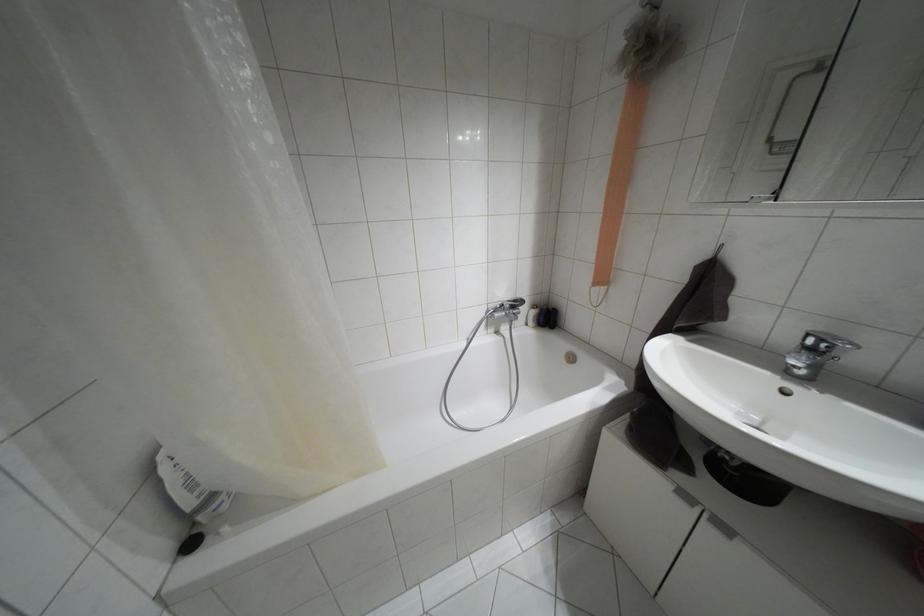
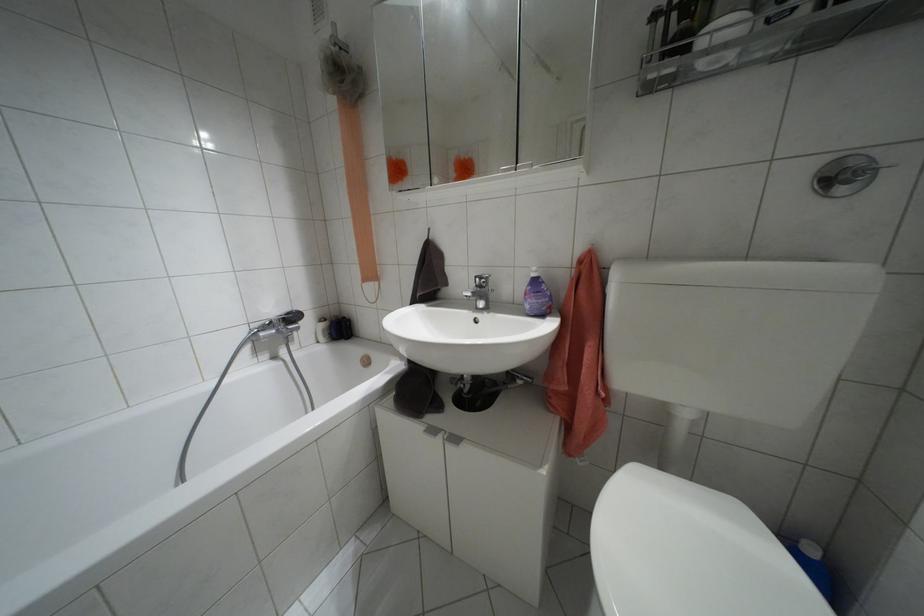
Find the pixel in the second image that matches pixel 514 301 in the first image.

(286, 313)